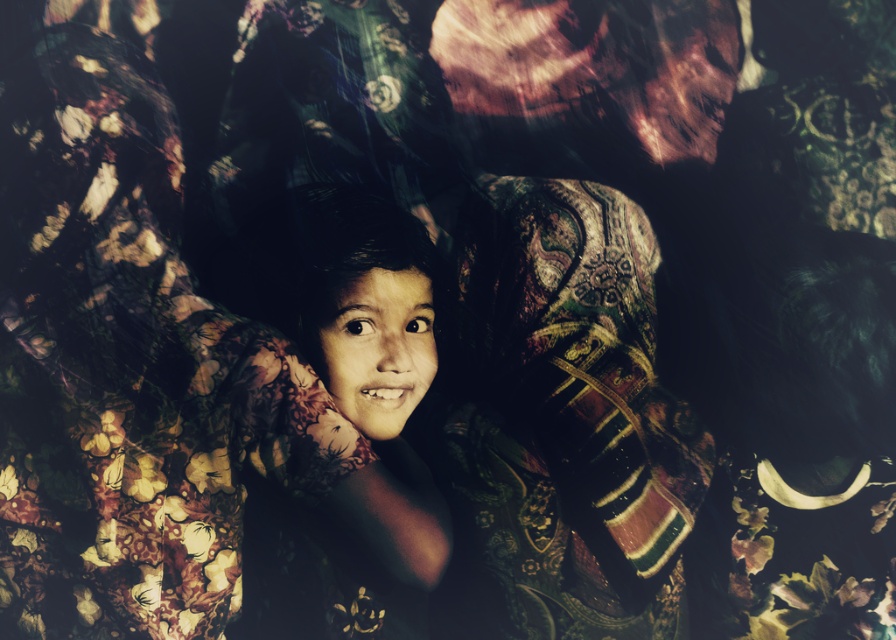
Consider the image. Can you confirm if richly embroidered fabric at center is shorter than smooth skin child at center?

Incorrect, richly embroidered fabric at center's height does not fall short of smooth skin child at center's.

Can you confirm if richly embroidered fabric at center is positioned to the right of smooth skin child at center?

Yes, richly embroidered fabric at center is to the right of smooth skin child at center.

Measure the distance between point (539, 392) and camera.

Point (539, 392) and camera are 1.54 meters apart.

Locate an element on the screen. richly embroidered fabric at center is located at coordinates (563, 419).